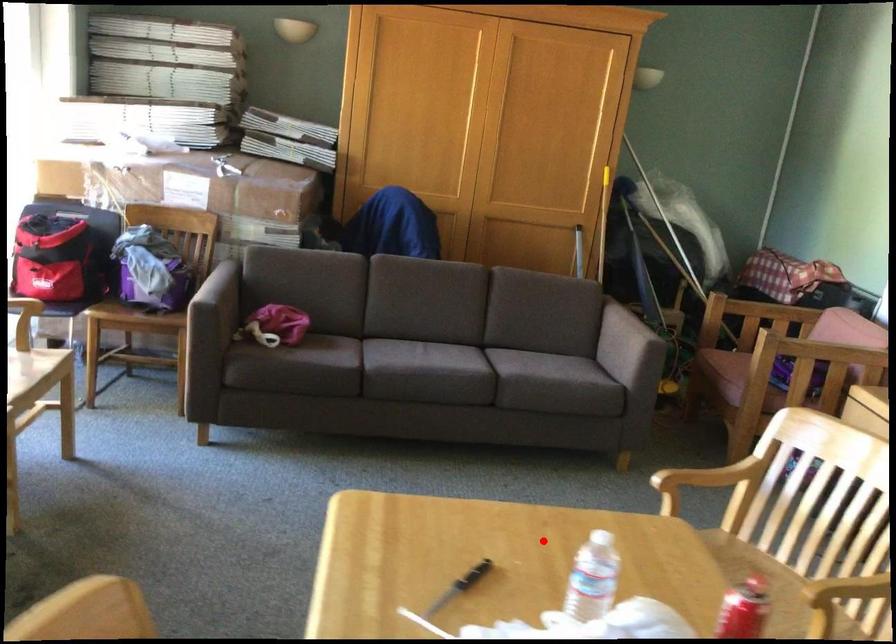
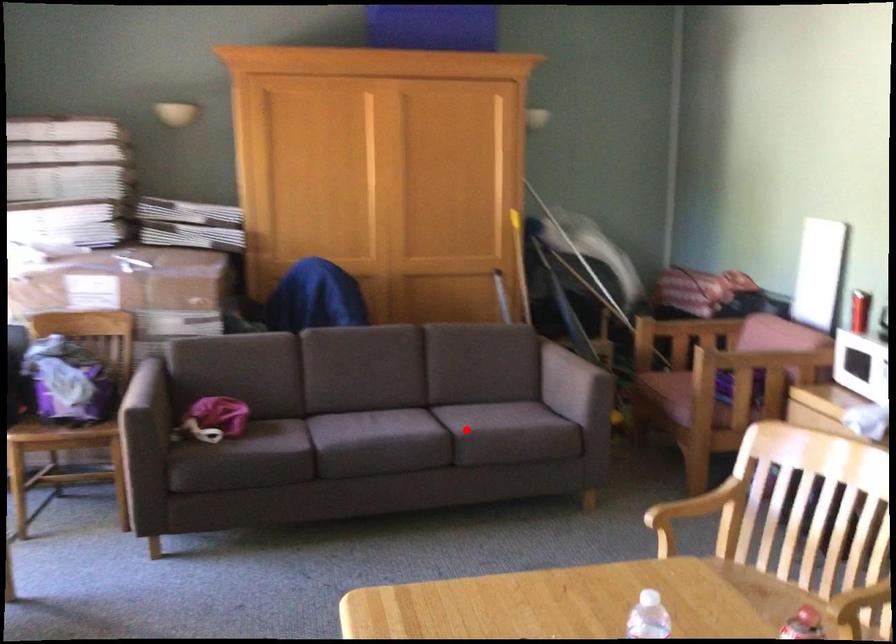
I am providing you with two images of the same scene from different viewpoints. A red point is marked on the first image and another point is marked on the second image. Is the marked point in image1 the same physical position as the marked point in image2?

No